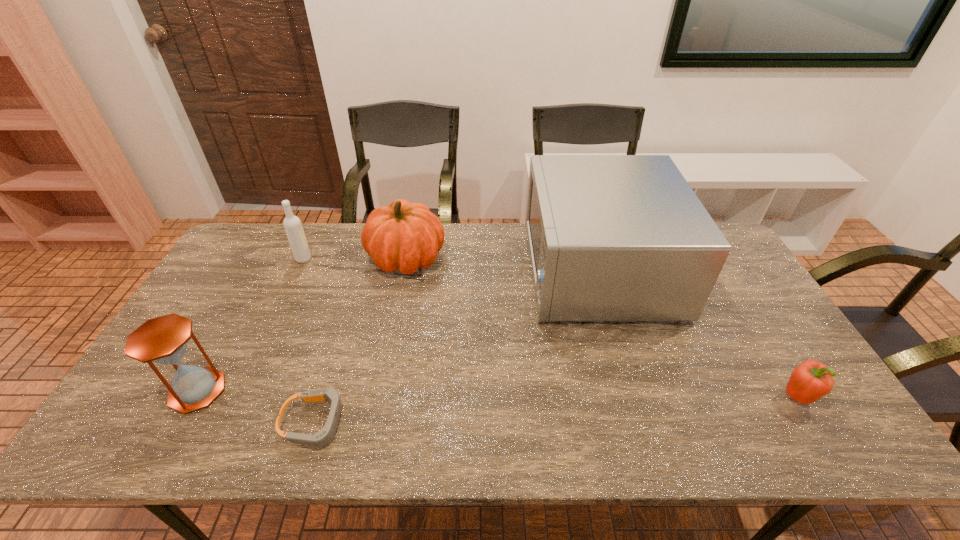
What are the coordinates of `free region that satisfies the following two spatial constraints: 1. on the back side of the pumpkin; 2. on the right side of the hourglass` in the screenshot? It's located at (271, 258).

Locate an element on the screen. This screenshot has height=540, width=960. free space in the image that satisfies the following two spatial constraints: 1. on the back side of the leftmost object; 2. on the left side of the vodka is located at coordinates (271, 259).